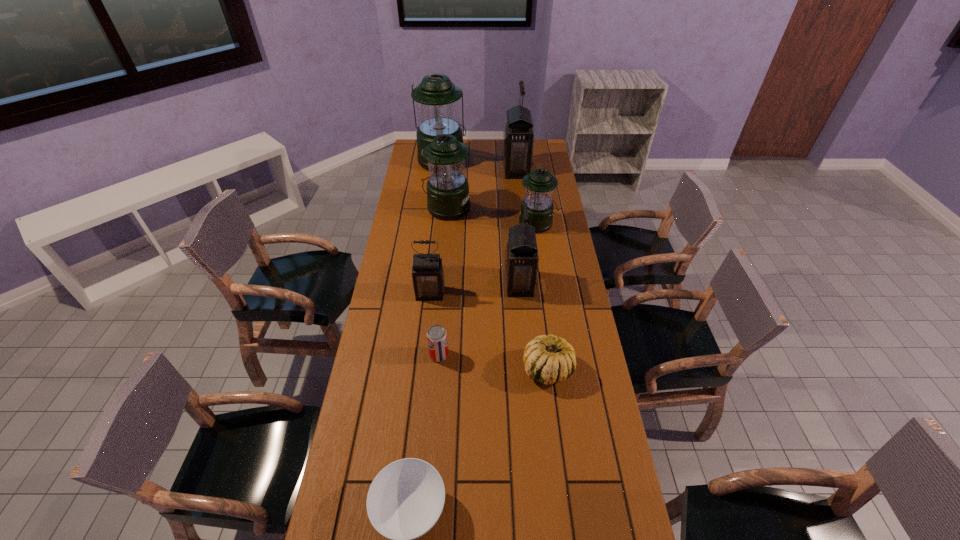
Where is `gourd located in the right edge section of the desktop`? gourd located in the right edge section of the desktop is located at coordinates (547, 359).

Where is `object at the far left corner`? Image resolution: width=960 pixels, height=540 pixels. object at the far left corner is located at coordinates (436, 97).

At what (x,y) coordinates should I click in order to perform the action: click on object that is at the far right corner. Please return your answer as a coordinate pair (x, y). The width and height of the screenshot is (960, 540). Looking at the image, I should click on (518, 138).

Find the location of a particular element. free space at the far edge of the desktop is located at coordinates (472, 146).

The image size is (960, 540). Identify the location of vacant space at the left edge. (372, 377).

Where is `vacant area at the right edge`? This screenshot has width=960, height=540. vacant area at the right edge is located at coordinates (564, 333).

Image resolution: width=960 pixels, height=540 pixels. I want to click on empty location between the farthest green lantern and the rightmost green lantern, so click(x=490, y=192).

Where is `unoccupied area between the smallest gray lantern and the white gourd`? unoccupied area between the smallest gray lantern and the white gourd is located at coordinates (489, 332).

At what (x,y) coordinates should I click in order to perform the action: click on free point between the second biggest green lantern and the rightmost green lantern. Please return your answer as a coordinate pair (x, y). This screenshot has height=540, width=960. Looking at the image, I should click on (492, 216).

Locate an element on the screen. Image resolution: width=960 pixels, height=540 pixels. vacant area that lies between the leftmost gray lantern and the farthest gray lantern is located at coordinates (473, 232).